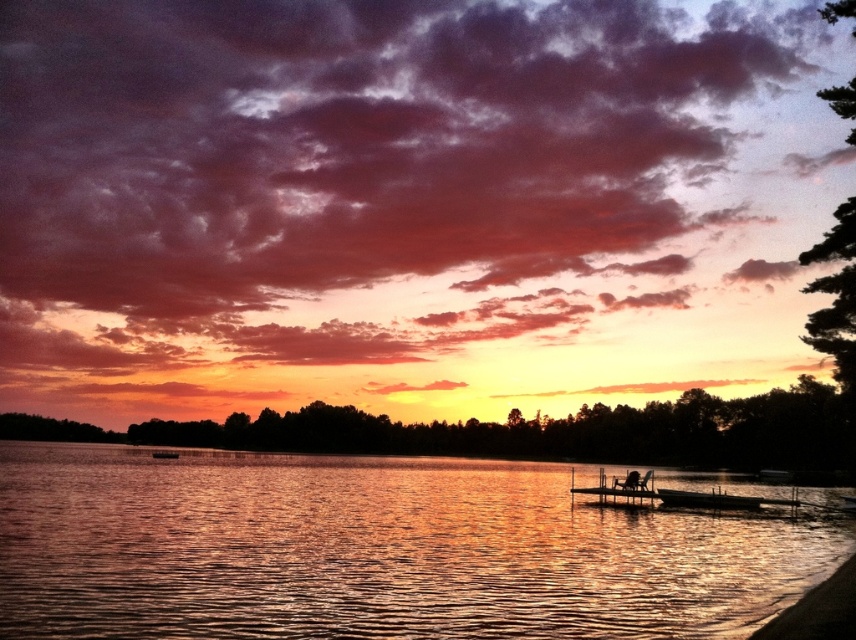
Between glistening water at center and wooden dock at center, which one appears on the right side from the viewer's perspective?

From the viewer's perspective, wooden dock at center appears more on the right side.

Is glistening water at center thinner than wooden dock at center?

No.

Does point (235, 504) lie in front of point (635, 488)?

Yes, it is.

Locate an element on the screen. This screenshot has width=856, height=640. glistening water at center is located at coordinates (375, 550).

The height and width of the screenshot is (640, 856). Describe the element at coordinates (375, 550) in the screenshot. I see `glistening water at center` at that location.

Is glistening water at center taller than smooth sand at lower right?

Correct, glistening water at center is much taller as smooth sand at lower right.

Between point (274, 547) and point (783, 636), which one is positioned in front?

Point (783, 636) is more forward.

I want to click on glistening water at center, so tap(375, 550).

Who is more forward, (687, 500) or (170, 456)?

Point (687, 500) is in front.

Is brown wooden canoe at center wider than dark brown wooden boat at center?

No, brown wooden canoe at center is not wider than dark brown wooden boat at center.

Is point (675, 497) behind point (169, 452)?

No, (675, 497) is closer to viewer.

The height and width of the screenshot is (640, 856). Find the location of `brown wooden canoe at center`. brown wooden canoe at center is located at coordinates (706, 499).